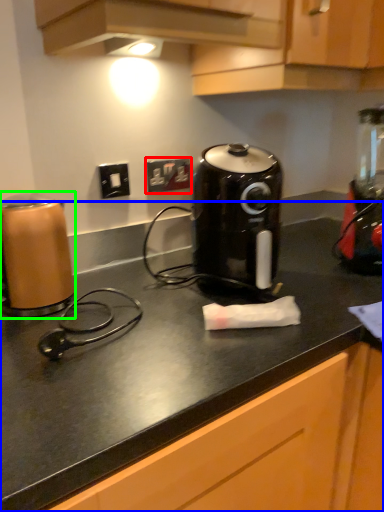
Question: Which is farther away from electric outlet (highlighted by a red box)? counter (highlighted by a blue box) or home appliance (highlighted by a green box)?

Choices:
 (A) counter
 (B) home appliance

Answer: (A)